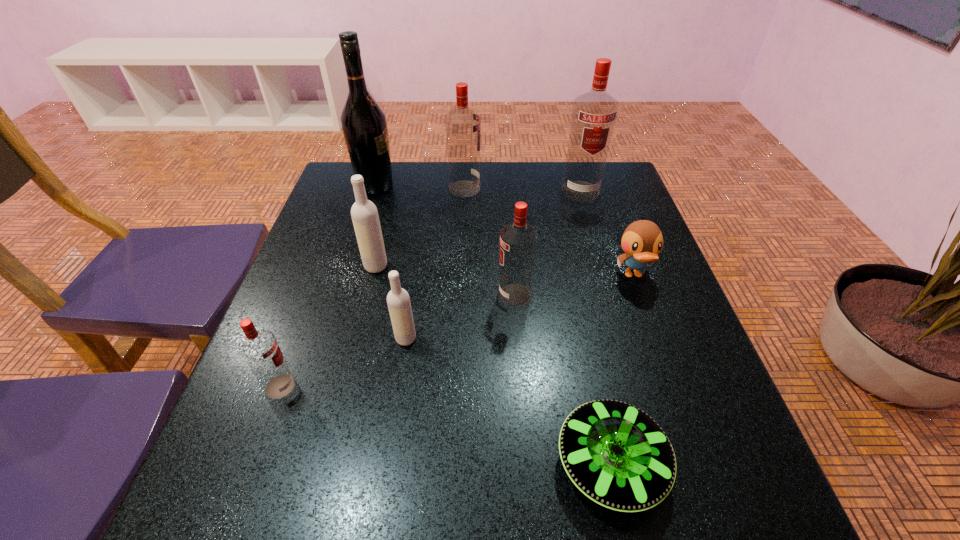
Where is `free space between the right white vodka and the nearest object`? free space between the right white vodka and the nearest object is located at coordinates (508, 401).

Image resolution: width=960 pixels, height=540 pixels. I want to click on free space between the bigger white vodka and the shortest object, so click(x=493, y=364).

Identify the location of object that can be found as the second closest to the wine bottle. This screenshot has height=540, width=960. (364, 213).

This screenshot has width=960, height=540. What are the coordinates of `the second closest object to the third farthest red vodka` in the screenshot? It's located at (642, 241).

You are a GUI agent. You are given a task and a screenshot of the screen. Output one action in this format:
    pyautogui.click(x=<x>, y=<y>)
    Task: Click on the vodka that stands as the sixth closest to the black wine bottle
    The image size is (960, 540).
    Given the screenshot: What is the action you would take?
    pyautogui.click(x=259, y=348)

Image resolution: width=960 pixels, height=540 pixels. I want to click on the fifth closest vodka to the second shortest object, so click(x=364, y=213).

The image size is (960, 540). I want to click on red vodka that can be found as the third closest to the leftmost red vodka, so click(594, 113).

At what (x,y) coordinates should I click in order to perform the action: click on the closest red vodka to the biggest red vodka. Please return your answer as a coordinate pair (x, y). The image size is (960, 540). Looking at the image, I should click on (463, 126).

What are the coordinates of `free space that satisfies the following two spatial constraints: 1. on the front label of the second red vodka from left to right; 2. on the front side of the fourth object from left to right` in the screenshot? It's located at (458, 339).

Locate an element on the screen. This screenshot has width=960, height=540. vacant space that satisfies the following two spatial constraints: 1. on the front-facing side of the blue duck; 2. on the front label of the nearest red vodka is located at coordinates (674, 386).